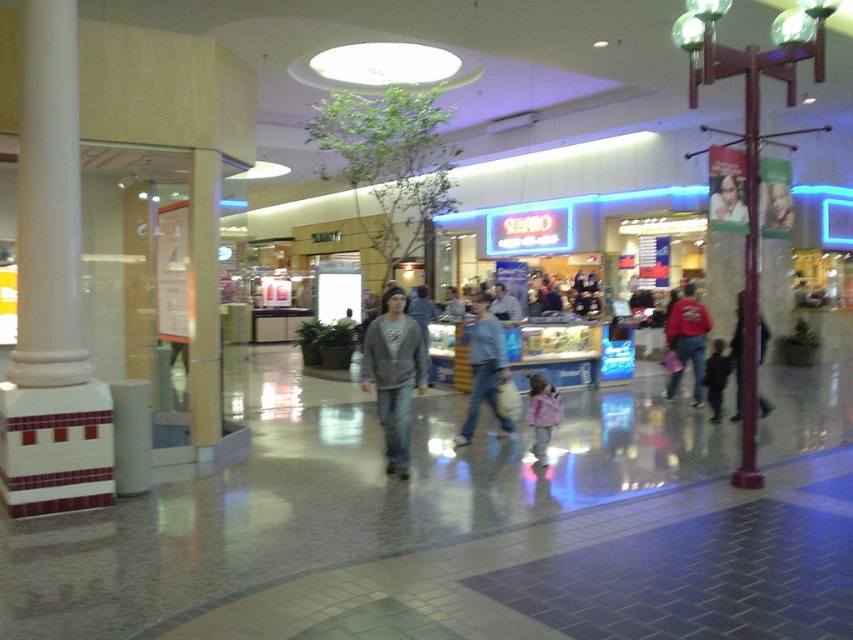
Question: Is dark gray hoodie at center smaller than smooth plastic poster at center?

Choices:
 (A) yes
 (B) no

Answer: (A)

Question: Does pink fuzzy coat at center appear on the left side of smooth plastic poster at center?

Choices:
 (A) yes
 (B) no

Answer: (A)

Question: Can you confirm if pink fuzzy coat at center is bigger than smooth plastic poster at center?

Choices:
 (A) yes
 (B) no

Answer: (A)

Question: Which point is farther to the camera?

Choices:
 (A) (718, 182)
 (B) (787, 232)
 (C) (740, 378)

Answer: (C)

Question: Which point is farther to the camera?

Choices:
 (A) (759, 356)
 (B) (720, 364)
 (C) (679, 342)
 (D) (479, 342)

Answer: (C)

Question: Considering the real-world distances, which object is farthest from the gray matte sweatshirt at center?

Choices:
 (A) pink fuzzy coat at center
 (B) smooth plastic face at center
 (C) smooth plastic poster at center

Answer: (B)